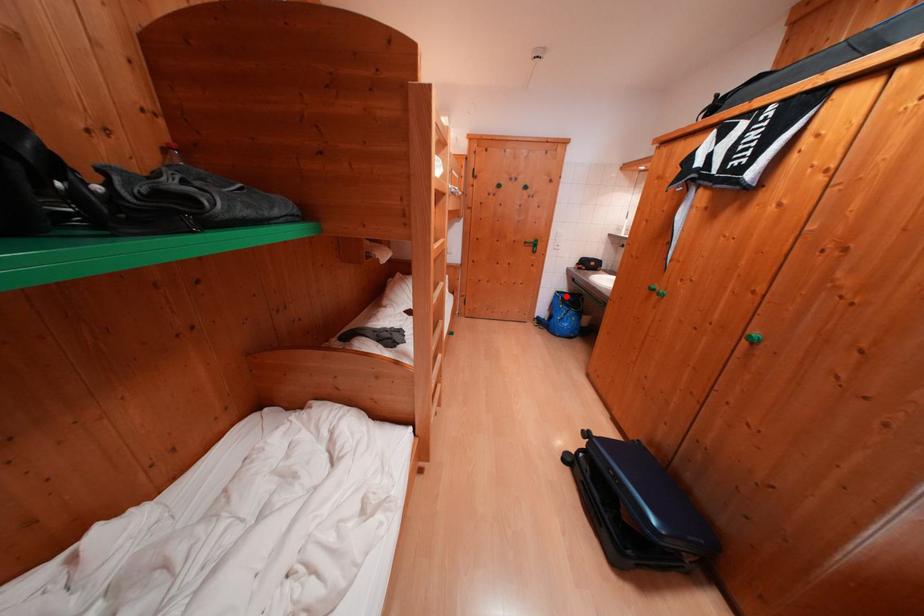
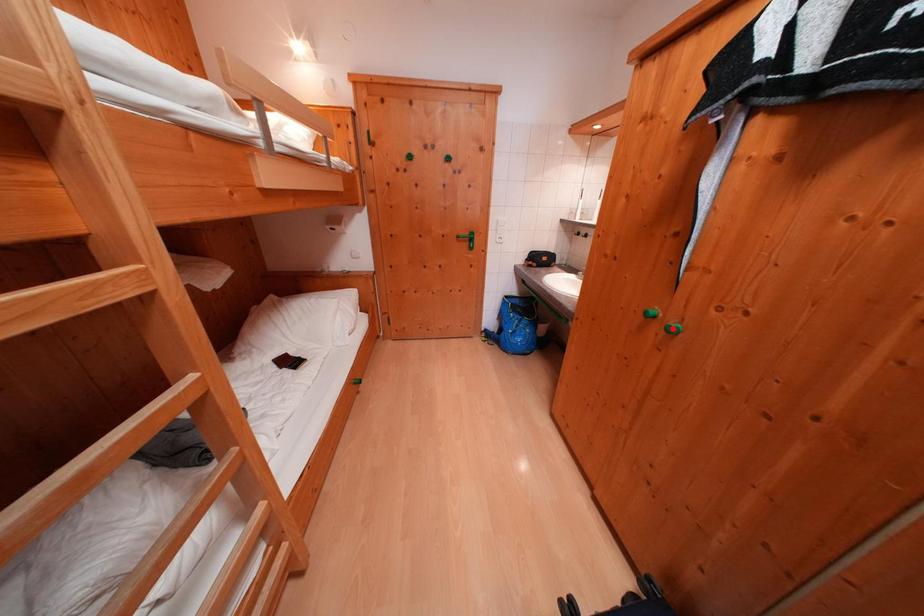
I am providing you with two images of the same scene from different viewpoints. A red point is marked on the first image and another point is marked on the second image. Are the points marked in image1 and image2 representing the same 3D position?

No